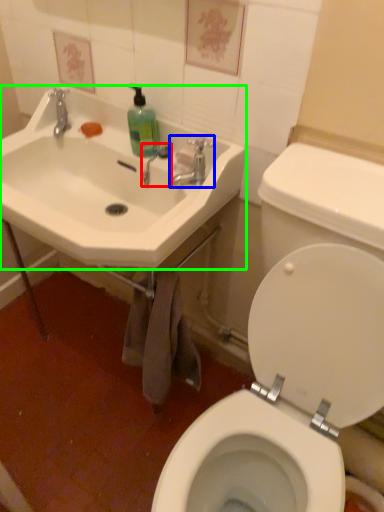
Question: Considering the real-world distances, which object is closest to plumbing fixture (highlighted by a red box)? tap (highlighted by a blue box) or sink (highlighted by a green box).

Choices:
 (A) tap
 (B) sink

Answer: (A)